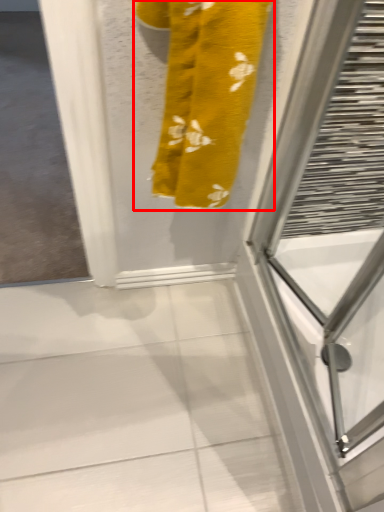
Question: From the image's perspective, considering the relative positions of towel (annotated by the red box) and screen door in the image provided, where is towel (annotated by the red box) located with respect to the staircase?

Choices:
 (A) below
 (B) above

Answer: (B)